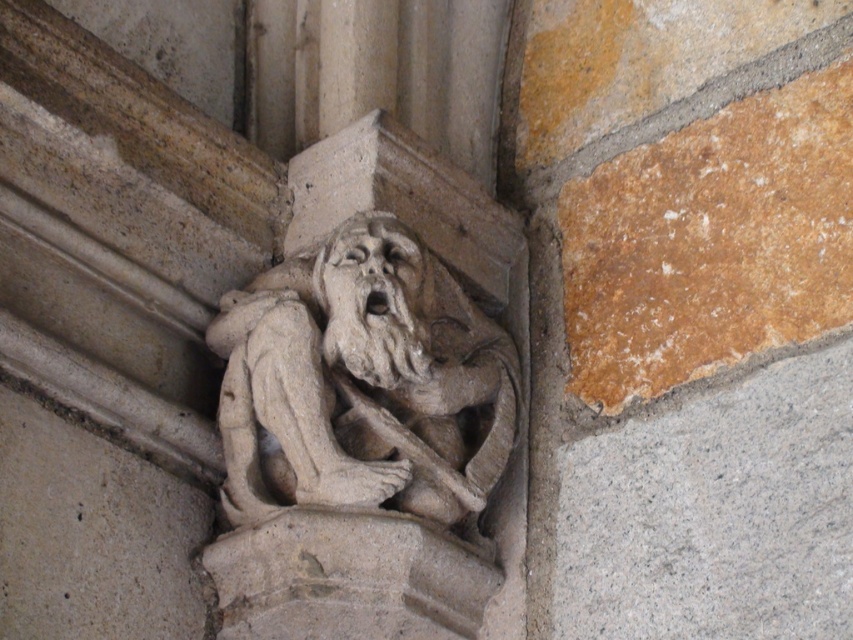
Is stone carved gargoyle at center positioned in front of gray stone face at center?

Yes, stone carved gargoyle at center is closer to the viewer.

Which is in front, point (352, 536) or point (318, 296)?

Positioned in front is point (352, 536).

The image size is (853, 640). Identify the location of stone carved gargoyle at center. [373, 403].